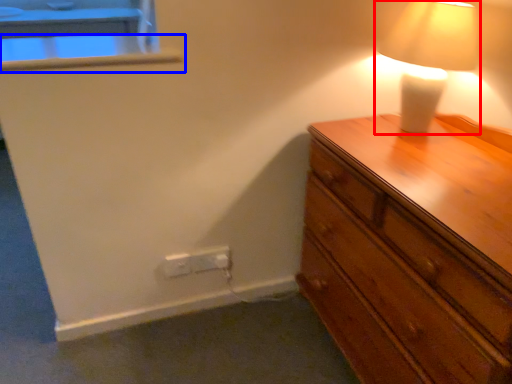
Question: Which object is closer to the camera taking this photo, lamp (highlighted by a red box) or window sill (highlighted by a blue box)?

Choices:
 (A) lamp
 (B) window sill

Answer: (A)